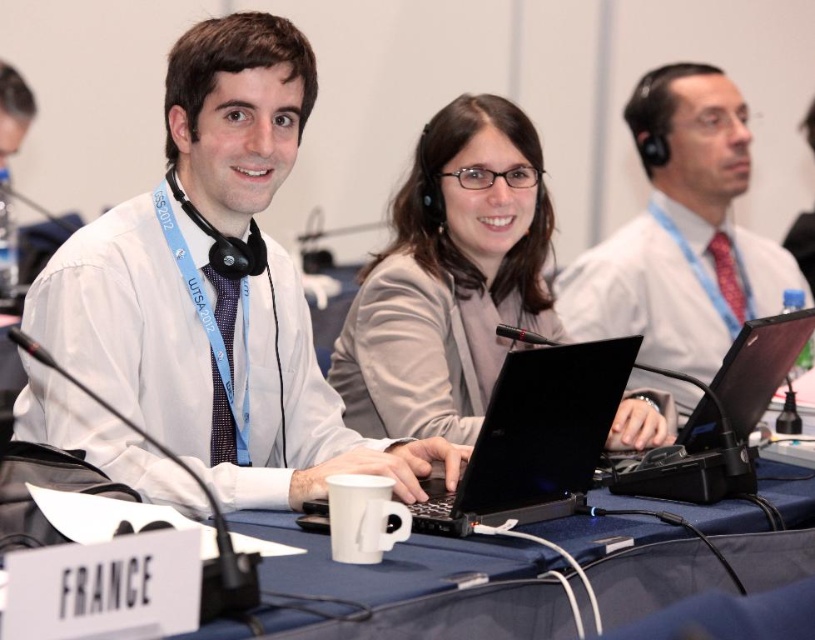
What do you see at coordinates (681, 232) in the screenshot? The height and width of the screenshot is (640, 815). I see `matte white shirt at center` at bounding box center [681, 232].

Can you confirm if matte white shirt at center is wider than black plastic laptop at center?

Correct, the width of matte white shirt at center exceeds that of black plastic laptop at center.

Find the location of `matte white shirt at center`. matte white shirt at center is located at coordinates coord(681,232).

Can you confirm if white shirt at center is positioned below black matte laptop at center?

Incorrect, white shirt at center is not positioned below black matte laptop at center.

Can you confirm if white shirt at center is shorter than black matte laptop at center?

No.

I want to click on white shirt at center, so click(218, 289).

Measure the distance between black matte laptop at center and black plastic laptop at center.

black matte laptop at center and black plastic laptop at center are 11.28 inches apart from each other.

Who is more distant from viewer, (x=637, y=337) or (x=708, y=451)?

Point (x=708, y=451)

Locate an element on the screen. black matte laptop at center is located at coordinates (534, 438).